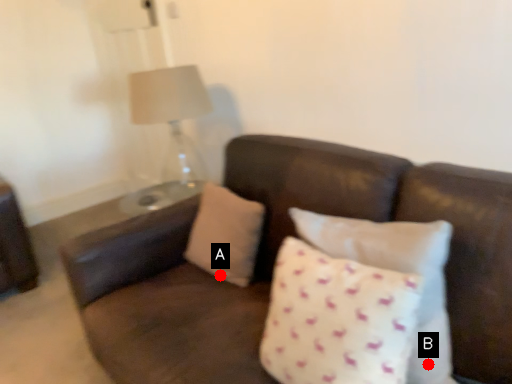
Question: Two points are circled on the image, labeled by A and B beside each circle. Among these points, which one is nearest to the camera?

Choices:
 (A) A is closer
 (B) B is closer

Answer: (B)